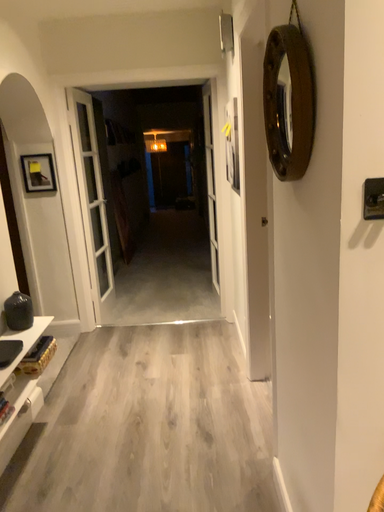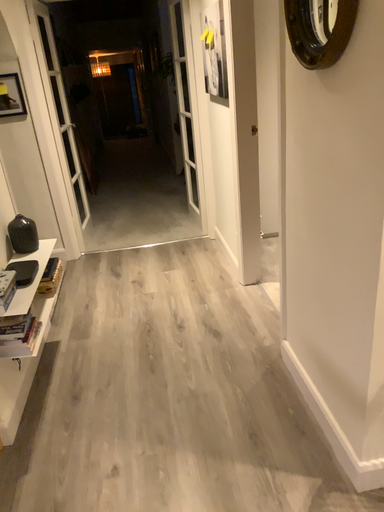
Question: How did the camera likely rotate when shooting the video?

Choices:
 (A) rotated upward
 (B) rotated downward

Answer: (B)